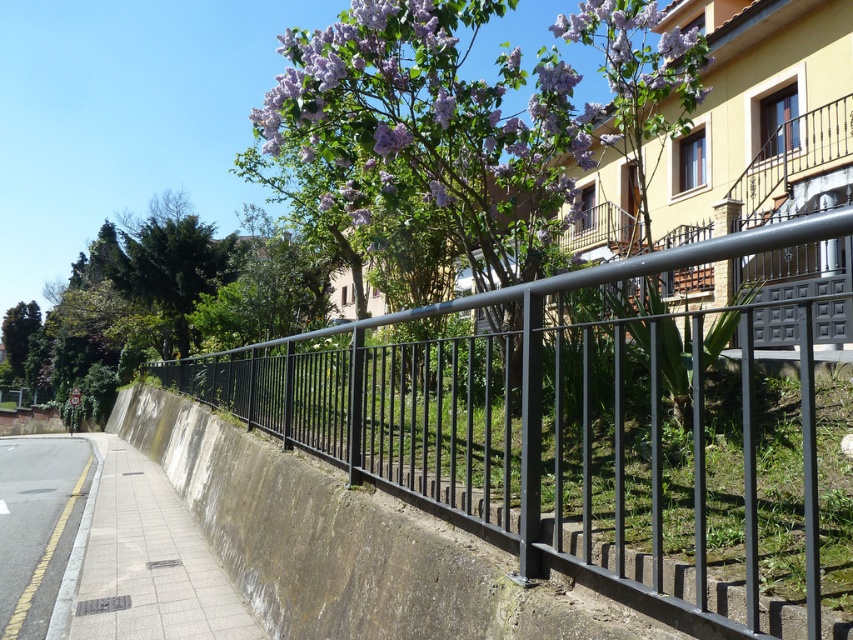
You are a delivery person trying to park your 1.2 meter wide cart between the black metal fence at center and the gray concrete pavement at lower left. Can your cart fit in the space between them?

The black metal fence at center is wider than the gray concrete pavement at lower left. However, the question is about the space between them, not their widths. The description only provides information about their widths, not the distance between them. Therefore, it is impossible to determine if the cart can fit based on the given information.